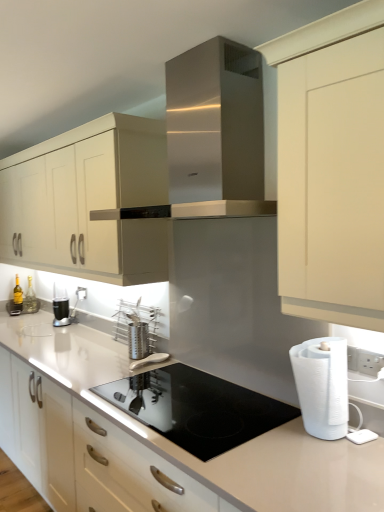
Question: Considering the relative positions of translucent glass bottle at left, acting as the second bottle starting from the right, and white plastic electric outlet at upper right in the image provided, is translucent glass bottle at left, acting as the second bottle starting from the right, to the left or to the right of white plastic electric outlet at upper right?

Choices:
 (A) right
 (B) left

Answer: (B)

Question: From a real-world perspective, is translucent glass bottle at left, acting as the second bottle starting from the right, positioned above or below white plastic electric outlet at upper right?

Choices:
 (A) below
 (B) above

Answer: (A)

Question: Estimate the real-world distances between objects in this image. Which object is farther from the matte white cabinet at upper center?

Choices:
 (A) translucent glass bottle at left, acting as the second bottle starting from the right
 (B) black glass gas stove at center
 (C) stainless steel range hood at center
 (D) stainless steel utensil holder at center, which is the 2th appliance in bottom-to-top order
 (E) satin silver utensil holder at center, marked as the second appliance in a top-to-bottom arrangement

Answer: (A)

Question: Considering the real-world distances, which object is closest to the stainless steel utensil holder at center, acting as the 1th appliance starting from the top?

Choices:
 (A) translucent glass bottle at left, the first bottle in the right-to-left sequence
 (B) white glossy countertop at center
 (C) black glass gas stove at center
 (D) matte white cabinet at upper center
 (E) metallic silver coffee machine at left

Answer: (B)